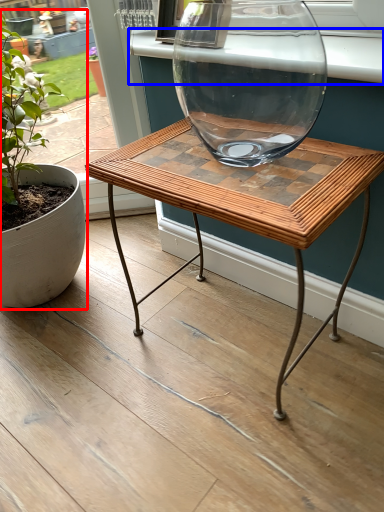
Question: Among these objects, which one is nearest to the camera, houseplant (highlighted by a red box) or window sill (highlighted by a blue box)?

Choices:
 (A) houseplant
 (B) window sill

Answer: (A)